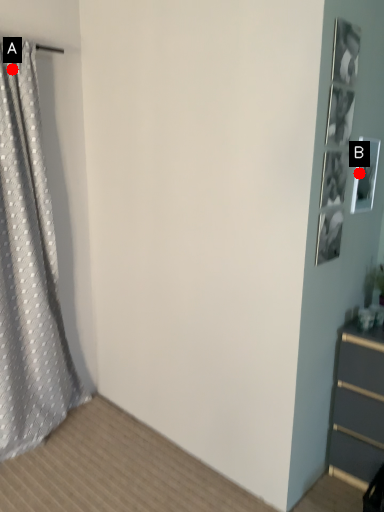
Question: Two points are circled on the image, labeled by A and B beside each circle. Which of the following is the farthest from the observer?

Choices:
 (A) A is further
 (B) B is further

Answer: (A)